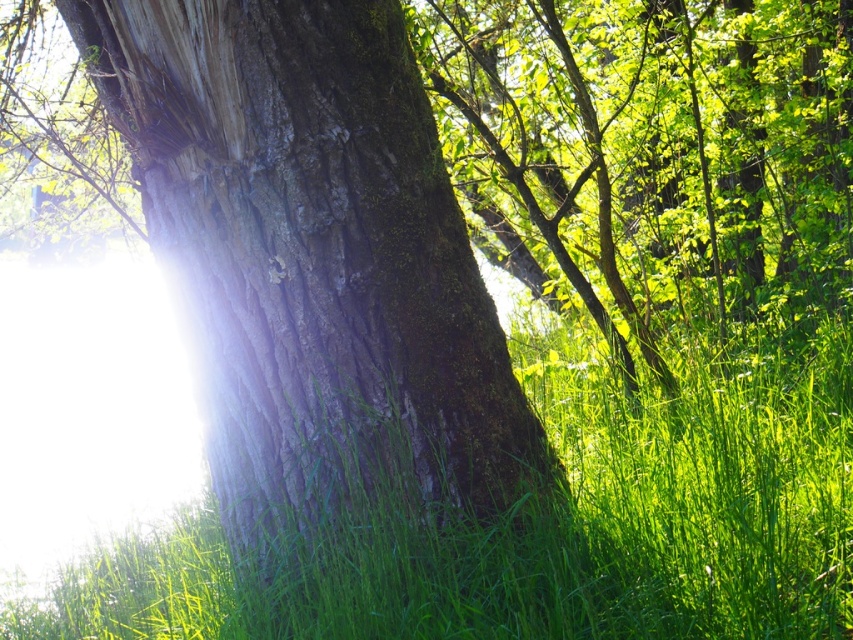
Question: Is smooth bark tree trunk at center to the right of green grass at center from the viewer's perspective?

Choices:
 (A) yes
 (B) no

Answer: (B)

Question: Does smooth bark tree trunk at center appear over green grass at center?

Choices:
 (A) yes
 (B) no

Answer: (A)

Question: Can you confirm if smooth bark tree trunk at center is bigger than green grass at center?

Choices:
 (A) no
 (B) yes

Answer: (A)

Question: Which object appears farthest from the camera in this image?

Choices:
 (A) green grass at center
 (B) smooth bark tree trunk at center

Answer: (B)